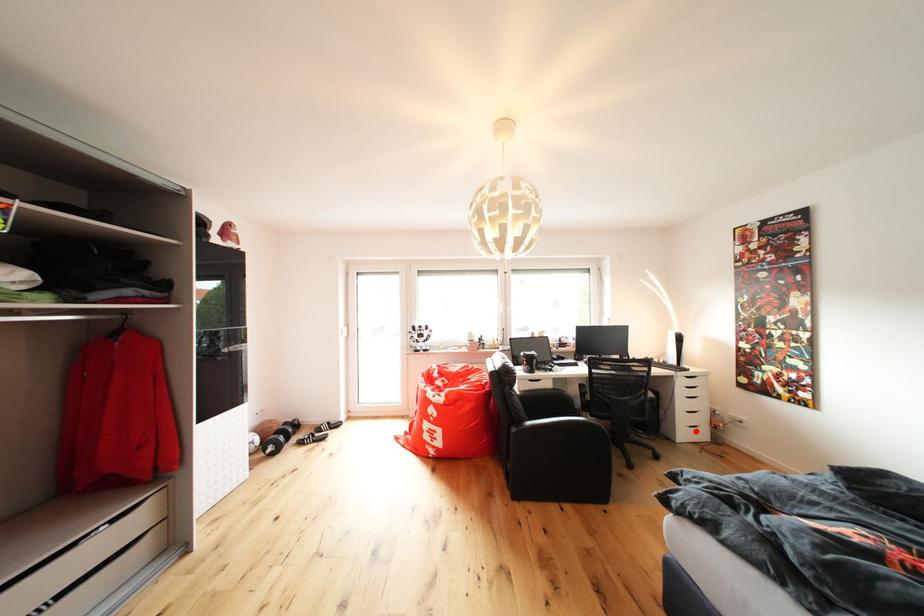
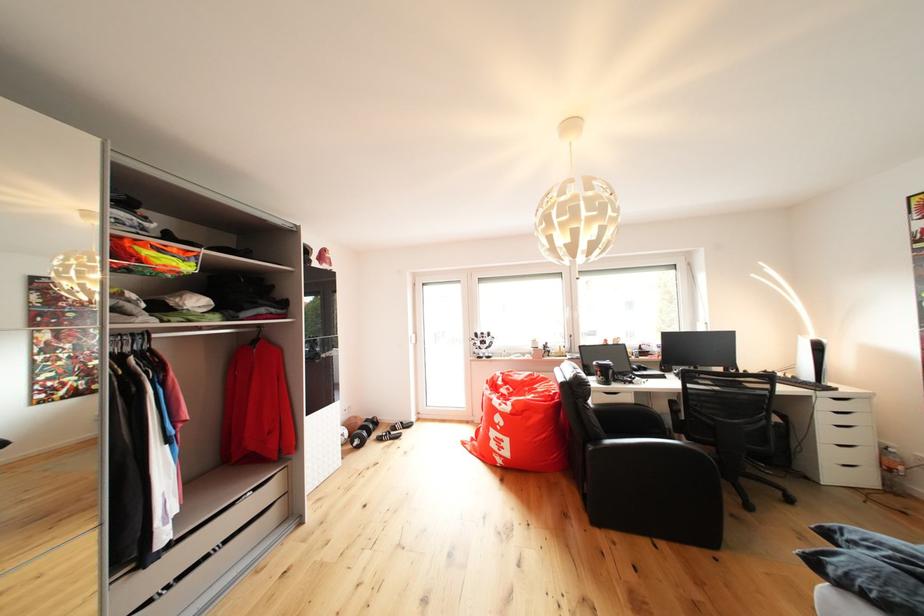
Question: I am providing you with two images of the same scene from different viewpoints. A red point is shown in image1. For the corresponding object point in image2, is it positioned nearer or farther from the camera?

Choices:
 (A) Nearer
 (B) Farther

Answer: (A)